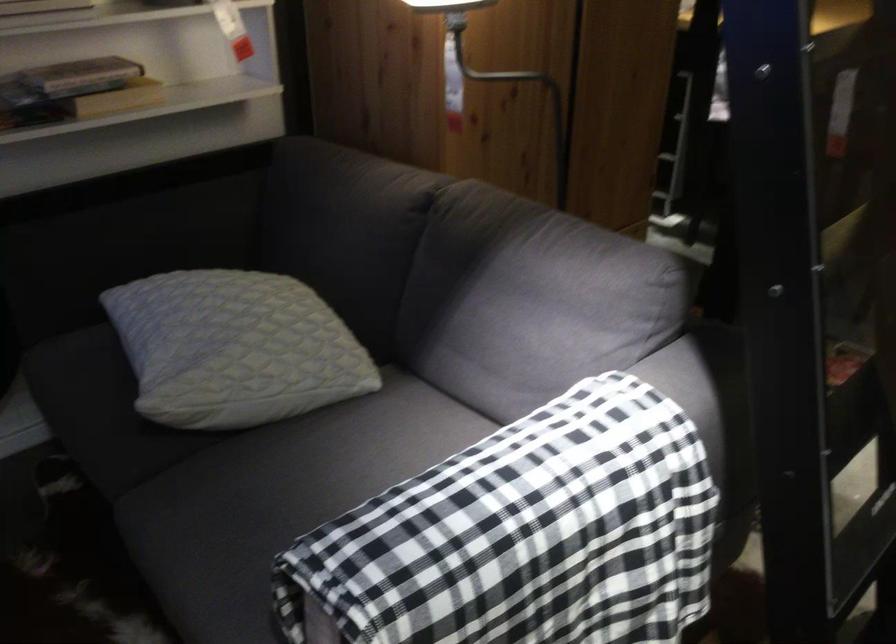
This screenshot has width=896, height=644. In order to click on sofa armrest in this screenshot , I will do `click(690, 395)`.